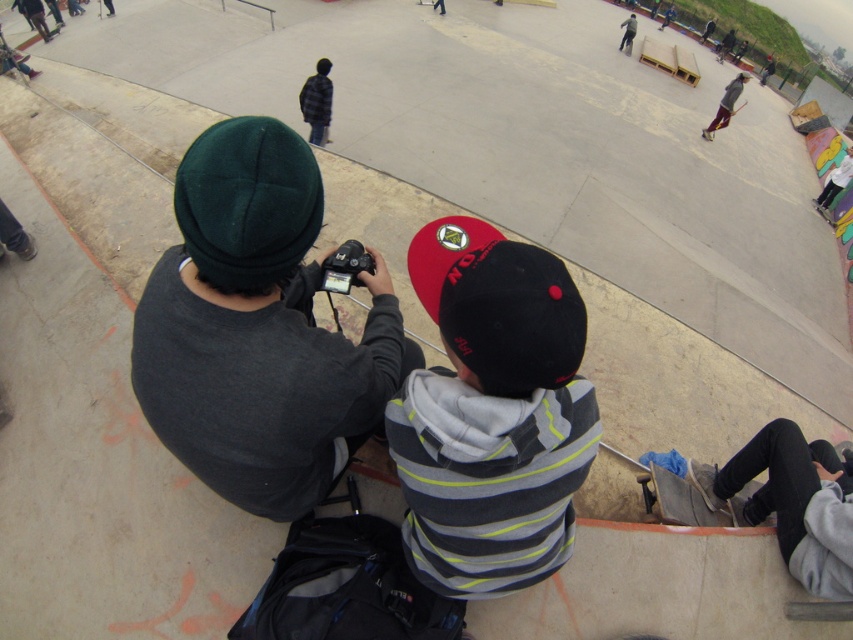
Question: Is dark gray fleece at left smaller than striped hoodie at center?

Choices:
 (A) no
 (B) yes

Answer: (A)

Question: Does wooden skateboard at lower right have a greater width compared to wooden skateboard at center?

Choices:
 (A) no
 (B) yes

Answer: (B)

Question: Which of these objects is positioned farthest from the dark gray fleece at left?

Choices:
 (A) wooden skateboard at center
 (B) striped hoodie at center

Answer: (A)

Question: Among these objects, which one is nearest to the camera?

Choices:
 (A) wooden skateboard at lower right
 (B) dark gray fleece at left
 (C) wooden skateboard at center
 (D) striped hoodie at center

Answer: (D)

Question: Can you confirm if striped hoodie at center is wider than wooden skateboard at lower right?

Choices:
 (A) no
 (B) yes

Answer: (A)

Question: Which object is closer to the camera taking this photo?

Choices:
 (A) dark gray fleece at left
 (B) striped hoodie at center
 (C) wooden skateboard at lower right

Answer: (B)